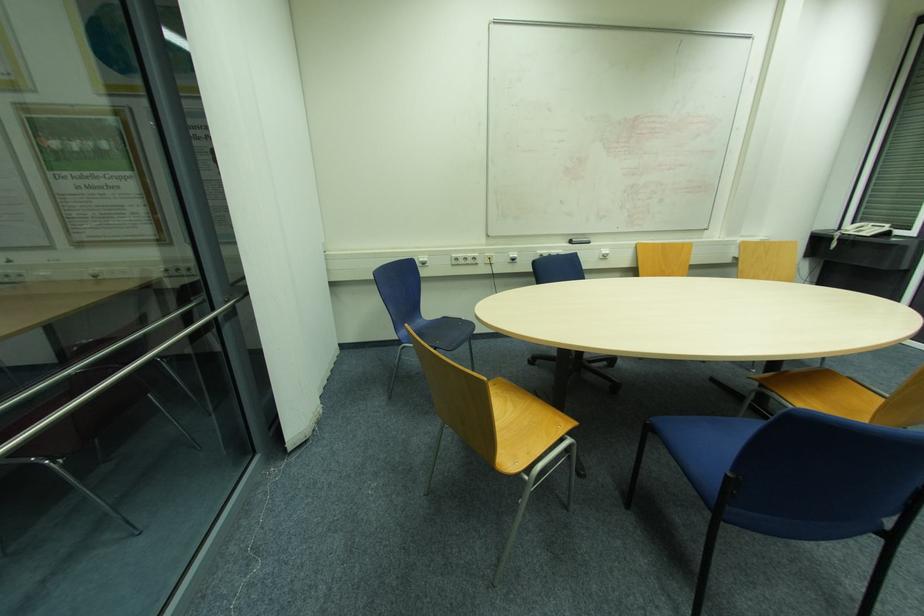
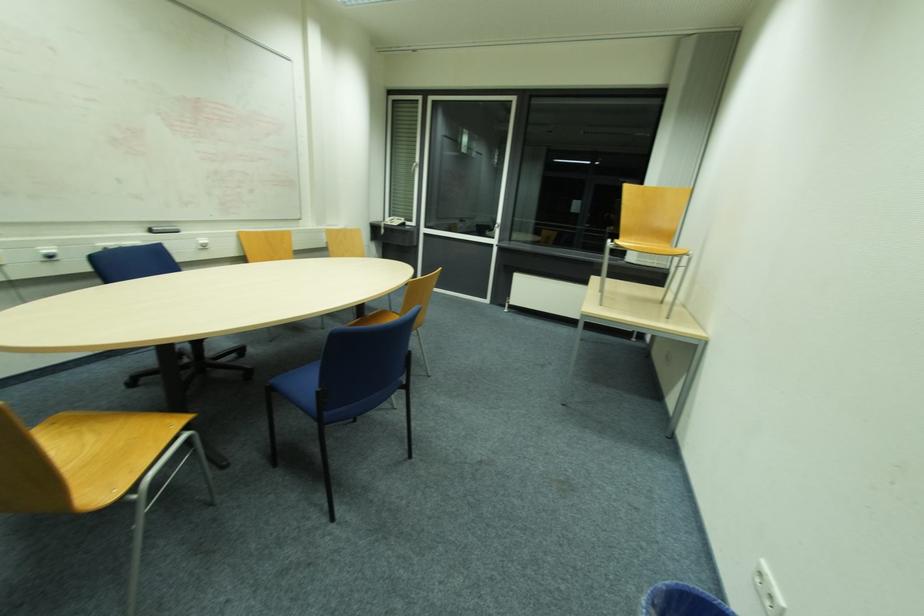
In the second image, find the point that corresponds to (511,407) in the first image.

(91, 439)